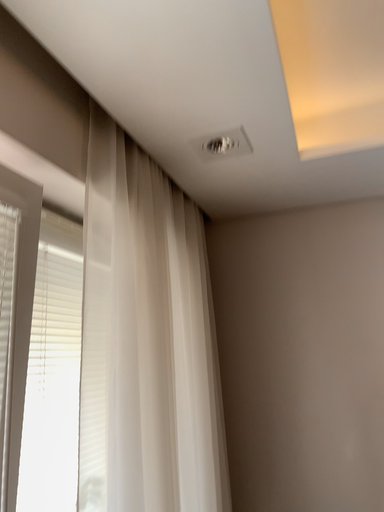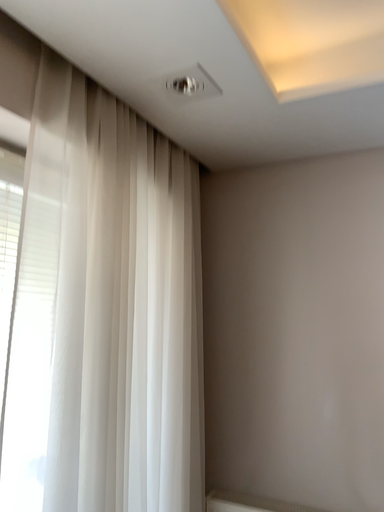
Question: Which way did the camera rotate in the video?

Choices:
 (A) rotated right
 (B) rotated left

Answer: (B)